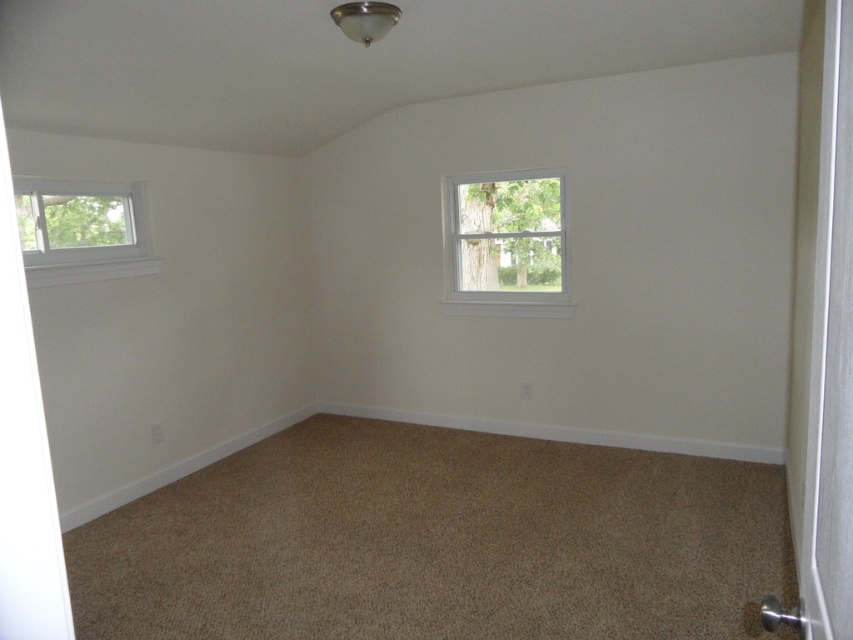
Is white wooden window at upper center taller than clear glass window at upper left?

Indeed, white wooden window at upper center has a greater height compared to clear glass window at upper left.

Is white wooden window at upper center below clear glass window at upper left?

Incorrect, white wooden window at upper center is not positioned below clear glass window at upper left.

Based on the photo, measure the distance between point (534, 193) and camera.

They are 5.87 meters apart.

Locate an element on the screen. This screenshot has height=640, width=853. white wooden window at upper center is located at coordinates (506, 243).